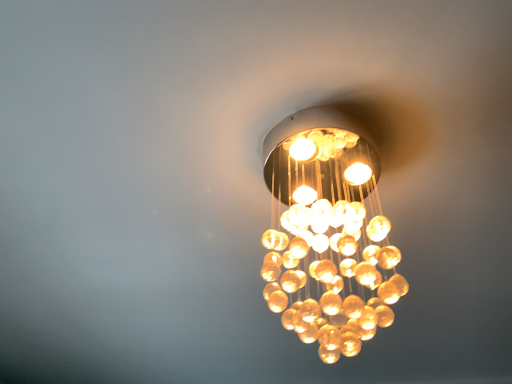
The width and height of the screenshot is (512, 384). Describe the element at coordinates (328, 232) in the screenshot. I see `translucent amber glass at center` at that location.

Where is `translucent amber glass at center`? translucent amber glass at center is located at coordinates (328, 232).

Where is `translucent amber glass at center`? This screenshot has height=384, width=512. translucent amber glass at center is located at coordinates (328, 232).